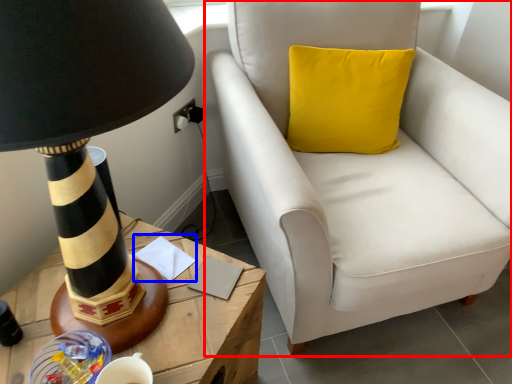
Question: Which point is closer to the camera, chair (highlighted by a red box) or notepad (highlighted by a blue box)?

Choices:
 (A) chair
 (B) notepad

Answer: (A)